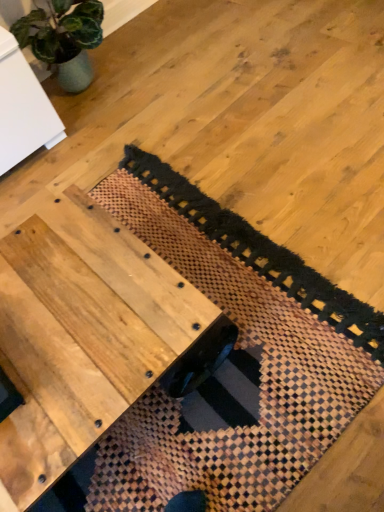
Question: Does wooden woven mat at center have a larger size compared to natural wood table at center?

Choices:
 (A) yes
 (B) no

Answer: (B)

Question: From a real-world perspective, is wooden woven mat at center under natural wood table at center?

Choices:
 (A) no
 (B) yes

Answer: (B)

Question: From the image's perspective, is wooden woven mat at center above natural wood table at center?

Choices:
 (A) no
 (B) yes

Answer: (B)

Question: Is the depth of wooden woven mat at center greater than that of natural wood table at center?

Choices:
 (A) no
 (B) yes

Answer: (B)

Question: Could you tell me if wooden woven mat at center is facing natural wood table at center?

Choices:
 (A) no
 (B) yes

Answer: (B)

Question: From a real-world perspective, is wooden woven mat at center on natural wood table at center?

Choices:
 (A) yes
 (B) no

Answer: (B)

Question: Can we say natural wood table at center lies outside wooden woven mat at center?

Choices:
 (A) yes
 (B) no

Answer: (A)

Question: Does natural wood table at center have a larger size compared to wooden woven mat at center?

Choices:
 (A) yes
 (B) no

Answer: (A)

Question: Is natural wood table at center oriented away from wooden woven mat at center?

Choices:
 (A) no
 (B) yes

Answer: (A)

Question: Can you confirm if natural wood table at center is positioned to the right of wooden woven mat at center?

Choices:
 (A) yes
 (B) no

Answer: (B)

Question: From the image's perspective, does natural wood table at center appear lower than wooden woven mat at center?

Choices:
 (A) yes
 (B) no

Answer: (A)

Question: From the image's perspective, is natural wood table at center located above wooden woven mat at center?

Choices:
 (A) yes
 (B) no

Answer: (B)

Question: Looking at the image, does wooden woven mat at center seem bigger or smaller compared to natural wood table at center?

Choices:
 (A) small
 (B) big

Answer: (A)